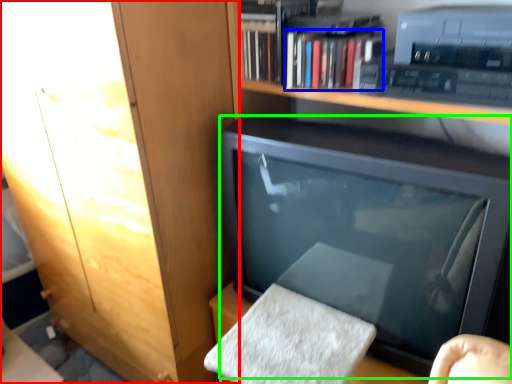
Question: Which is nearer to the cabinetry (highlighted by a red box)? book (highlighted by a blue box) or television (highlighted by a green box).

Choices:
 (A) book
 (B) television

Answer: (B)